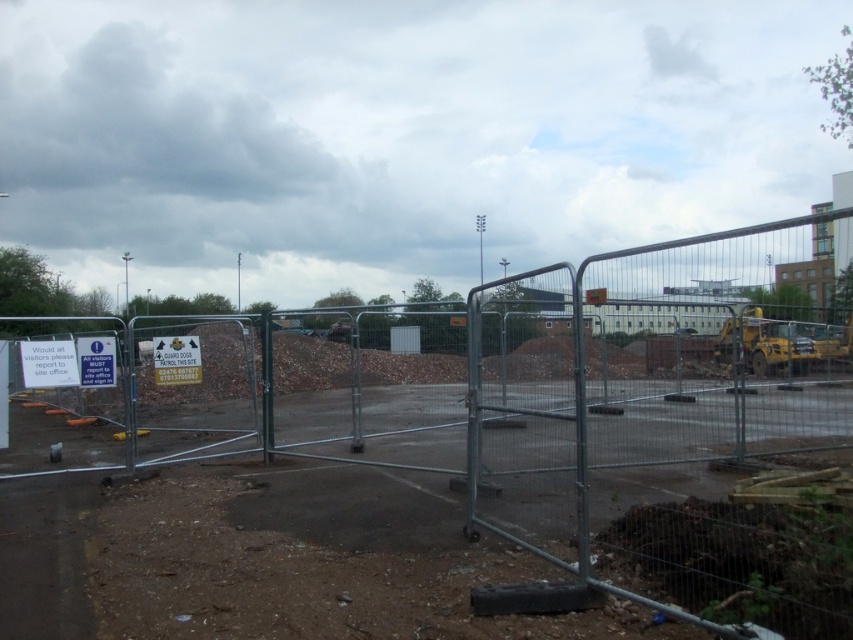
Question: Can you confirm if white paper sign at lower left is positioned above white paper sign at left?

Choices:
 (A) no
 (B) yes

Answer: (B)

Question: Which object is the closest to the metal fence at center?

Choices:
 (A) yellow plastic sign at center
 (B) white paper sign at lower left

Answer: (A)

Question: Which object appears closest to the camera in this image?

Choices:
 (A) metal fence at center
 (B) white paper sign at left
 (C) metallic silver fence at center

Answer: (C)

Question: Can you confirm if metal fence at center is thinner than metallic silver fence at center?

Choices:
 (A) yes
 (B) no

Answer: (B)

Question: In this image, where is metal fence at center located relative to yellow plastic sign at center?

Choices:
 (A) right
 (B) left

Answer: (A)

Question: Based on their relative distances, which object is nearer to the metal fence at center?

Choices:
 (A) white paper sign at left
 (B) white paper sign at lower left

Answer: (A)